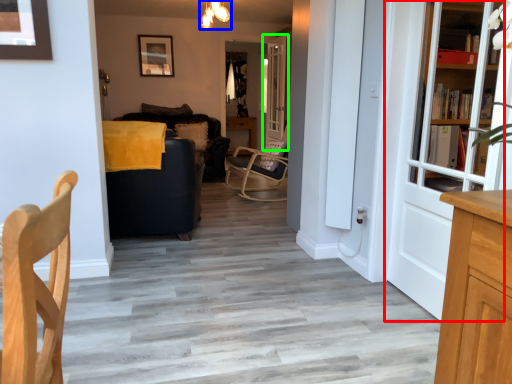
Question: Estimate the real-world distances between objects in this image. Which object is closer to door (highlighted by a red box), light fixture (highlighted by a blue box) or door (highlighted by a green box)?

Choices:
 (A) light fixture
 (B) door

Answer: (A)